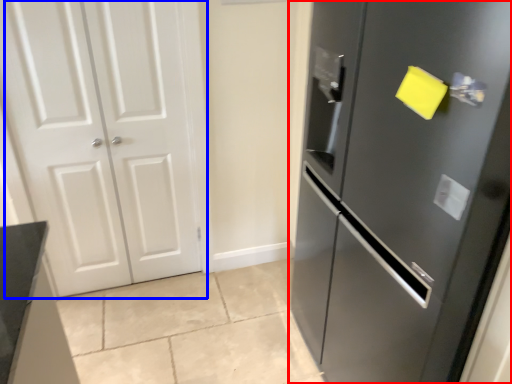
Question: Which object appears farthest to the camera in this image, door (highlighted by a red box) or door (highlighted by a blue box)?

Choices:
 (A) door
 (B) door

Answer: (B)